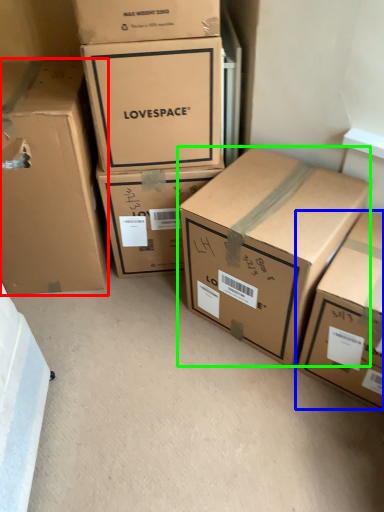
Question: Based on their relative distances, which object is nearer to box (highlighted by a red box)? Choose from box (highlighted by a blue box) and box (highlighted by a green box).

Choices:
 (A) box
 (B) box

Answer: (B)